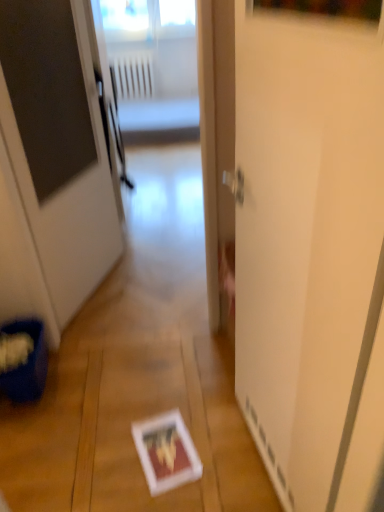
Question: Is white plastic radiator at upper center wider or thinner than white glossy screen door at center?

Choices:
 (A) wide
 (B) thin

Answer: (A)

Question: Is white plastic radiator at upper center taller or shorter than white glossy screen door at center?

Choices:
 (A) tall
 (B) short

Answer: (B)

Question: Estimate the real-world distances between objects in this image. Which object is closer to the white glossy door at center?

Choices:
 (A) white glossy screen door at center
 (B) white plastic radiator at upper center

Answer: (A)

Question: Which object is positioned farthest from the white plastic radiator at upper center?

Choices:
 (A) white glossy door at center
 (B) white glossy screen door at center

Answer: (B)